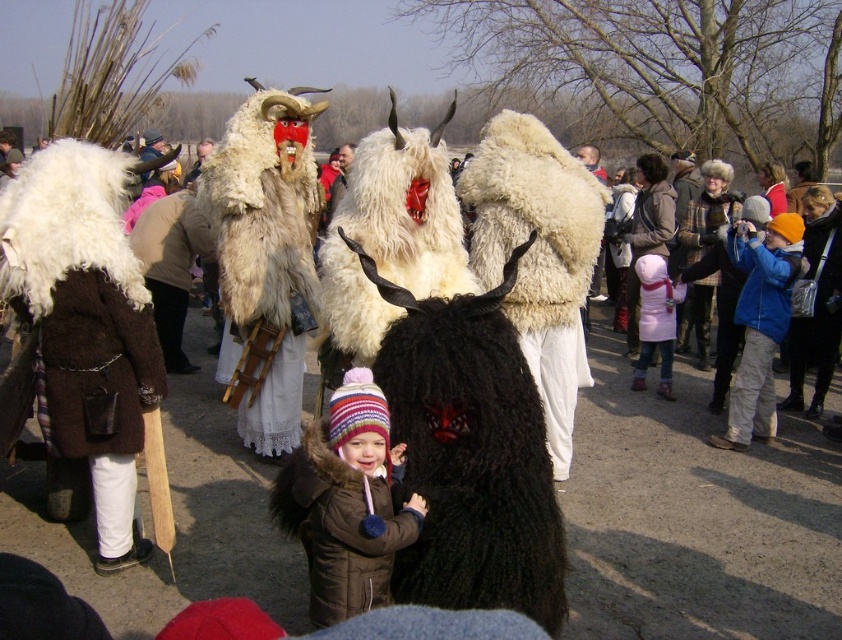
You are a photographer at the event and want to capture a photo where both the black woolen mask at center and the furry costume at center are clearly visible. Considering their sizes, which object should you focus on first to ensure both are in frame?

The black woolen mask at center is not as tall as the furry costume at center, so you should focus on the taller furry costume at center first to ensure both fit within the frame.

You are a photographer at the event and want to capture a photo of the furry costume at center and the furry white mask at center in a way that both are clearly visible. Based on their positions, which object should you focus on first to ensure both are in frame?

The furry white mask at center is to the right of the furry costume at center, so you should focus on the furry costume at center first to ensure both are in frame.